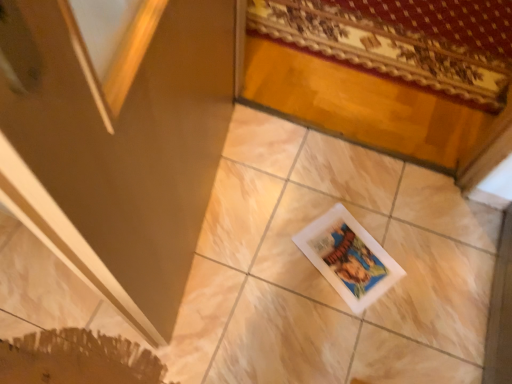
You are a GUI agent. You are given a task and a screenshot of the screen. Output one action in this format:
    pyautogui.click(x=<x>, y=<y>)
    Task: Click on the spots to the right of matte brown screen door at lower left
    This screenshot has height=384, width=512.
    Given the screenshot: What is the action you would take?
    pyautogui.click(x=336, y=238)